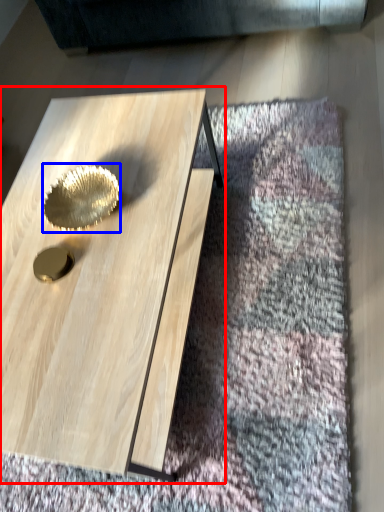
Question: Which object appears farthest to the camera in this image, coffee table (highlighted by a red box) or gold (highlighted by a blue box)?

Choices:
 (A) coffee table
 (B) gold

Answer: (B)